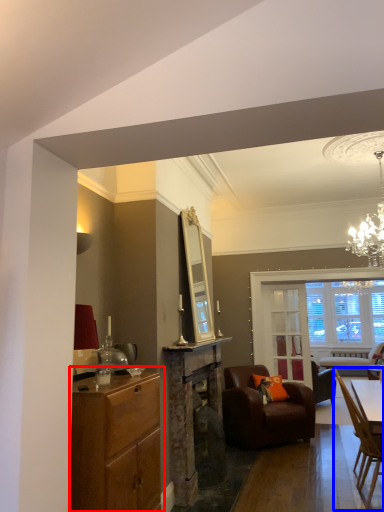
Question: Among these objects, which one is nearest to the camera, cabinetry (highlighted by a red box) or chair (highlighted by a blue box)?

Choices:
 (A) cabinetry
 (B) chair

Answer: (A)